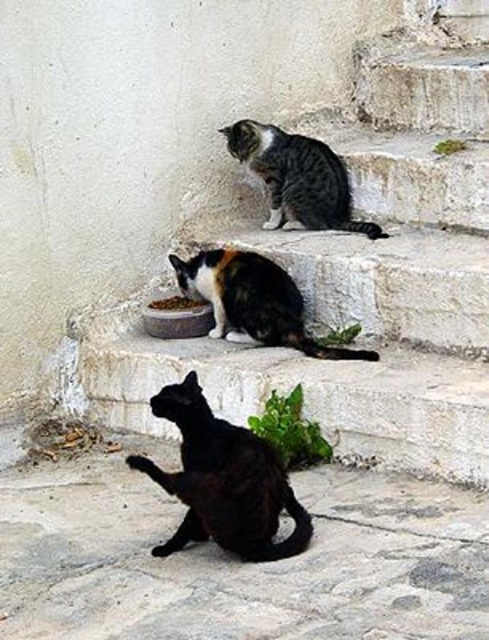
Question: Can you confirm if white stone stairs at center is thinner than striped fur cat at upper center?

Choices:
 (A) yes
 (B) no

Answer: (B)

Question: Which point appears farthest from the camera in this image?

Choices:
 (A) (267, 308)
 (B) (288, 193)

Answer: (B)

Question: From the image, what is the correct spatial relationship of black matte cat at lower center in relation to calico fur cat at center?

Choices:
 (A) right
 (B) left

Answer: (B)

Question: Which point is closer to the camera taking this photo?

Choices:
 (A) (480, 99)
 (B) (180, 308)

Answer: (B)

Question: Among these objects, which one is nearest to the camera?

Choices:
 (A) white stone stairs at center
 (B) striped fur cat at upper center
 (C) calico fur cat at center
 (D) black matte cat at lower center

Answer: (D)

Question: Is black matte cat at lower center to the right of striped fur cat at upper center from the viewer's perspective?

Choices:
 (A) yes
 (B) no

Answer: (B)